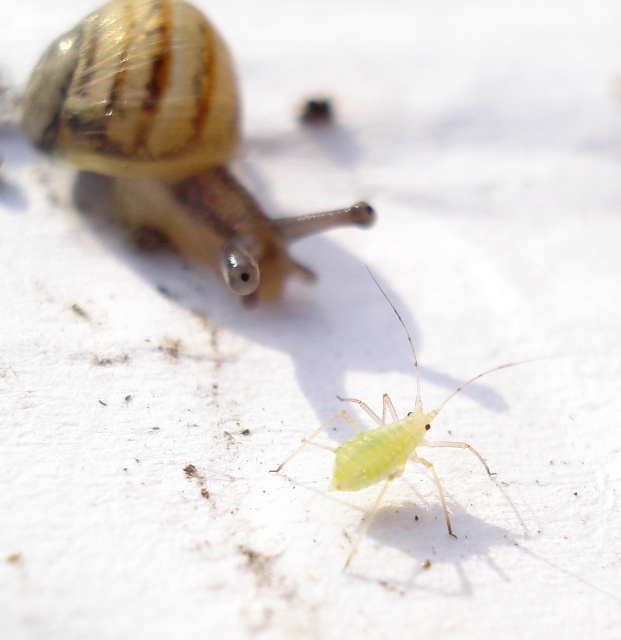
Is translucent brown snail at upper left shorter than green translucent aphid at center?

In fact, translucent brown snail at upper left may be taller than green translucent aphid at center.

Does translucent brown snail at upper left appear over green translucent aphid at center?

Indeed, translucent brown snail at upper left is positioned over green translucent aphid at center.

Image resolution: width=621 pixels, height=640 pixels. What are the coordinates of `translucent brown snail at upper left` in the screenshot? It's located at (165, 136).